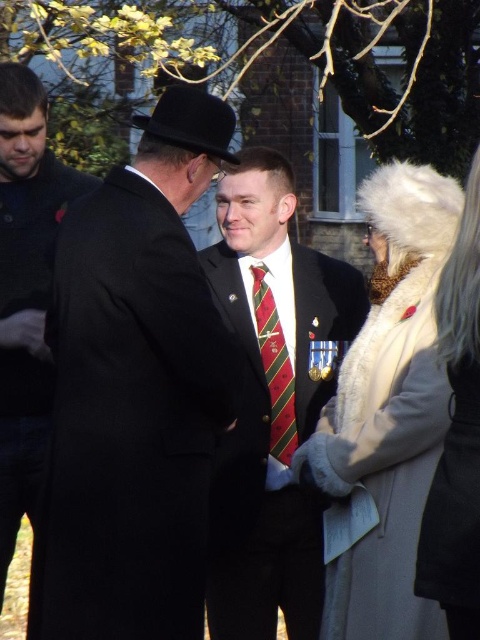
You are standing at the camera position and want to know how far the point at coordinates (380,262) is from you. Can you determine the distance?

The point at coordinates (380,262) is 5.93 meters away from the camera.

You are attending a formal event and notice two attendees dressed in a matte black coat at left and a red striped tie at center. Which one is taller?

The matte black coat at left is much taller than the red striped tie at center.

You are at a formal event and need to find the fur coat at center and the matte black coat at left. Which one is located to the right of the other?

The fur coat at center is positioned on the right side of the matte black coat at left.